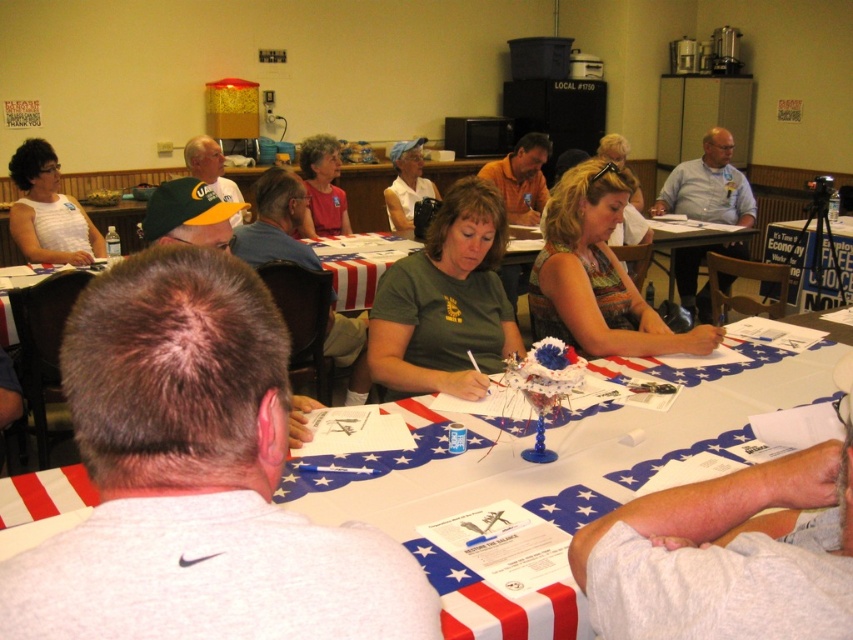
You are standing at point (354, 385) and want to move to point (677, 275). Based on the scene, is the destination point behind you or in front of you?

→ The destination point (677, 275) is behind you because it is located behind point (354, 385) where you are standing.

You are organizing a photo shoot and need to position two models wearing the gray shirt at center and the white matte shirt at upper left. Based on the scene description, which model should stand to the left when facing the camera?

The white matte shirt at upper left should stand to the left because the gray shirt at center is positioned to the right of it in the original scene.